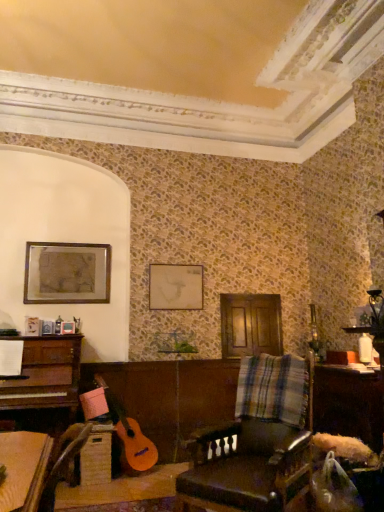
In order to face leather at center, should I rotate leftwards or rightwards?

To align with it, rotate right about 8.346°.

Measure the distance between wooden table at lower right and camera.

The depth of wooden table at lower right is 2.98 meters.

The height and width of the screenshot is (512, 384). Find the location of `matte white picture frame at center, the 1th picture frame from the right`. matte white picture frame at center, the 1th picture frame from the right is located at coordinates (175, 287).

From their relative heights in the image, would you say wooden table at lower right is taller or shorter than leather at center?

wooden table at lower right is shorter than leather at center.

Can you confirm if wooden table at lower right is smaller than leather at center?

Yes, wooden table at lower right is smaller than leather at center.

Considering the relative positions of wooden table at lower right and leather at center in the image provided, is wooden table at lower right in front of leather at center?

No.

Is leather at center at the back of wooden table at lower right?

No, wooden table at lower right's orientation is not away from leather at center.

Can you tell me how much matte gold picture frame at upper left, which ranks as the first picture frame in left-to-right order, and matte white picture frame at center, the 1th picture frame from the right, differ in facing direction?

The angle between the facing direction of matte gold picture frame at upper left, which ranks as the first picture frame in left-to-right order, and the facing direction of matte white picture frame at center, the 1th picture frame from the right, is 0.277 degrees.

Does matte gold picture frame at upper left, which ranks as the first picture frame in left-to-right order, turn towards matte white picture frame at center, which ranks as the 2th picture frame in left-to-right order?

No, matte gold picture frame at upper left, which ranks as the first picture frame in left-to-right order, is not facing towards matte white picture frame at center, which ranks as the 2th picture frame in left-to-right order.

Is matte gold picture frame at upper left, which is the 2th picture frame from right to left, at the right side of matte white picture frame at center, the 1th picture frame from the right?

No.

Where is `picture frame above the matte white picture frame at center, the 1th picture frame from the right (from the image's perspective)`? This screenshot has width=384, height=512. picture frame above the matte white picture frame at center, the 1th picture frame from the right (from the image's perspective) is located at coordinates (67, 273).

From the image's perspective, would you say matte gold picture frame at upper left, which ranks as the first picture frame in left-to-right order, is shown under leather at center?

Incorrect, from the image's perspective, matte gold picture frame at upper left, which ranks as the first picture frame in left-to-right order, is higher than leather at center.

From the picture: Considering the sizes of objects matte gold picture frame at upper left, which ranks as the first picture frame in left-to-right order, and leather at center in the image provided, who is bigger, matte gold picture frame at upper left, which ranks as the first picture frame in left-to-right order, or leather at center?

Bigger between the two is leather at center.

Is matte gold picture frame at upper left, which is the 2th picture frame from right to left, behind leather at center?

That is True.

Looking at their sizes, would you say matte gold picture frame at upper left, which is the 2th picture frame from right to left, is wider or thinner than leather at center?

In the image, matte gold picture frame at upper left, which is the 2th picture frame from right to left, appears to be more narrow than leather at center.

From the image's perspective, which one is positioned higher, matte white picture frame at center, which ranks as the 2th picture frame in left-to-right order, or wooden table at lower right?

matte white picture frame at center, which ranks as the 2th picture frame in left-to-right order, from the image's perspective.

Is the position of matte white picture frame at center, which ranks as the 2th picture frame in left-to-right order, more distant than that of wooden table at lower right?

Yes, matte white picture frame at center, which ranks as the 2th picture frame in left-to-right order, is behind wooden table at lower right.

Is matte white picture frame at center, the 1th picture frame from the right, taller or shorter than wooden table at lower right?

Clearly, matte white picture frame at center, the 1th picture frame from the right, is shorter compared to wooden table at lower right.

Choose the correct answer: Is matte white picture frame at center, the 1th picture frame from the right, inside wooden table at lower right or outside it?

matte white picture frame at center, the 1th picture frame from the right, lies outside wooden table at lower right.

Where is `picture frame above the matte white picture frame at center, the 1th picture frame from the right (from a real-world perspective)`? This screenshot has height=512, width=384. picture frame above the matte white picture frame at center, the 1th picture frame from the right (from a real-world perspective) is located at coordinates (67, 273).

From the picture: Is matte white picture frame at center, which ranks as the 2th picture frame in left-to-right order, closer to camera compared to matte gold picture frame at upper left, which ranks as the first picture frame in left-to-right order?

No, matte white picture frame at center, which ranks as the 2th picture frame in left-to-right order, is further to the viewer.

Is matte white picture frame at center, which ranks as the 2th picture frame in left-to-right order, thinner than matte gold picture frame at upper left, which ranks as the first picture frame in left-to-right order?

Yes, matte white picture frame at center, which ranks as the 2th picture frame in left-to-right order, is thinner than matte gold picture frame at upper left, which ranks as the first picture frame in left-to-right order.

What's the angular difference between matte gold picture frame at upper left, which is the 2th picture frame from right to left, and wooden table at lower right's facing directions?

matte gold picture frame at upper left, which is the 2th picture frame from right to left, and wooden table at lower right are facing 91.2 degrees away from each other.

Looking at this image, from their relative heights in the image, would you say matte gold picture frame at upper left, which is the 2th picture frame from right to left, is taller or shorter than wooden table at lower right?

matte gold picture frame at upper left, which is the 2th picture frame from right to left, is shorter than wooden table at lower right.

Which object is positioned more to the right, matte gold picture frame at upper left, which is the 2th picture frame from right to left, or wooden table at lower right?

wooden table at lower right.

Is matte gold picture frame at upper left, which is the 2th picture frame from right to left, located outside wooden table at lower right?

Indeed, matte gold picture frame at upper left, which is the 2th picture frame from right to left, is completely outside wooden table at lower right.

Is point (169, 309) positioned after point (274, 461)?

Yes, it is behind point (274, 461).

In the scene shown: Can you confirm if matte white picture frame at center, which ranks as the 2th picture frame in left-to-right order, is positioned to the left of leather at center?

Yes, matte white picture frame at center, which ranks as the 2th picture frame in left-to-right order, is to the left of leather at center.

From the image's perspective, would you say matte white picture frame at center, which ranks as the 2th picture frame in left-to-right order, is positioned over leather at center?

Indeed, from the image's perspective, matte white picture frame at center, which ranks as the 2th picture frame in left-to-right order, is shown above leather at center.

Measure the distance from matte white picture frame at center, which ranks as the 2th picture frame in left-to-right order, to leather at center.

They are 1.80 meters apart.

Locate an element on the screen. The image size is (384, 512). table located below the leather at center (from the image's perspective) is located at coordinates (349, 403).

This screenshot has width=384, height=512. In order to click on picture frame below the matte gold picture frame at upper left, which is the 2th picture frame from right to left (from a real-world perspective) in this screenshot , I will do coord(175,287).

Considering their positions, is wooden table at lower right positioned closer to leather at center than matte gold picture frame at upper left, which ranks as the first picture frame in left-to-right order?

The object closer to leather at center is wooden table at lower right.

Looking at the image, which one is located closer to matte gold picture frame at upper left, which ranks as the first picture frame in left-to-right order, leather at center or wooden table at lower right?

leather at center is positioned closer to the anchor matte gold picture frame at upper left, which ranks as the first picture frame in left-to-right order.

Looking at the image, which one is located further to leather at center, matte white picture frame at center, which ranks as the 2th picture frame in left-to-right order, or wooden table at lower right?

matte white picture frame at center, which ranks as the 2th picture frame in left-to-right order, is positioned further to the anchor leather at center.

Which object lies nearer to the anchor point matte gold picture frame at upper left, which is the 2th picture frame from right to left, wooden table at lower right or leather at center?

leather at center.

When comparing their distances from matte white picture frame at center, which ranks as the 2th picture frame in left-to-right order, does wooden table at lower right or matte gold picture frame at upper left, which ranks as the first picture frame in left-to-right order, seem closer?

matte gold picture frame at upper left, which ranks as the first picture frame in left-to-right order, is positioned closer to the anchor matte white picture frame at center, which ranks as the 2th picture frame in left-to-right order.

Based on the photo, considering their positions, is matte white picture frame at center, which ranks as the 2th picture frame in left-to-right order, positioned further to matte gold picture frame at upper left, which is the 2th picture frame from right to left, than leather at center?

The object further to matte gold picture frame at upper left, which is the 2th picture frame from right to left, is leather at center.

Estimate the real-world distances between objects in this image. Which object is further from leather at center, matte gold picture frame at upper left, which ranks as the first picture frame in left-to-right order, or matte white picture frame at center, the 1th picture frame from the right?

Based on the image, matte gold picture frame at upper left, which ranks as the first picture frame in left-to-right order, appears to be further to leather at center.

When comparing their distances from matte white picture frame at center, which ranks as the 2th picture frame in left-to-right order, does matte gold picture frame at upper left, which ranks as the first picture frame in left-to-right order, or wooden table at lower right seem further?

wooden table at lower right is positioned further to the anchor matte white picture frame at center, which ranks as the 2th picture frame in left-to-right order.

You are a GUI agent. You are given a task and a screenshot of the screen. Output one action in this format:
    pyautogui.click(x=<x>, y=<y>)
    Task: Click on the picture frame located between matte gold picture frame at upper left, which is the 2th picture frame from right to left, and wooden table at lower right in the left-right direction
    The image size is (384, 512).
    Given the screenshot: What is the action you would take?
    pyautogui.click(x=175, y=287)

Identify the location of table between leather at center and matte white picture frame at center, the 1th picture frame from the right, from front to back. (349, 403).

This screenshot has height=512, width=384. Find the location of `picture frame between leather at center and matte white picture frame at center, which ranks as the 2th picture frame in left-to-right order, in the front-back direction`. picture frame between leather at center and matte white picture frame at center, which ranks as the 2th picture frame in left-to-right order, in the front-back direction is located at coordinates click(x=67, y=273).

This screenshot has width=384, height=512. Identify the location of chair situated between matte gold picture frame at upper left, which is the 2th picture frame from right to left, and wooden table at lower right from left to right. (255, 441).